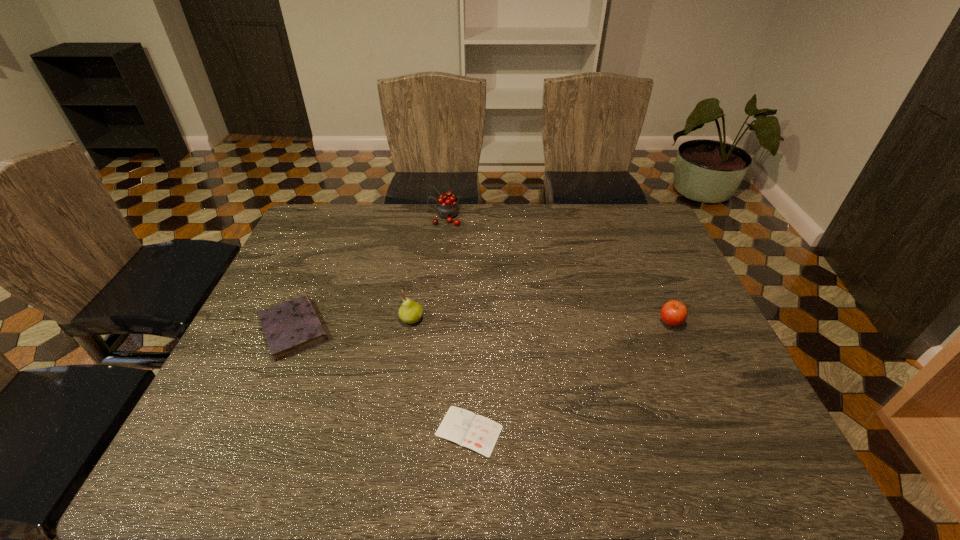
At what (x,y) coordinates should I click in order to perform the action: click on the farthest object. Please return your answer as a coordinate pair (x, y). Looking at the image, I should click on tap(447, 207).

Image resolution: width=960 pixels, height=540 pixels. I want to click on pear, so click(410, 312).

Where is `the rightmost object`? the rightmost object is located at coordinates (674, 313).

Where is `apple`? The height and width of the screenshot is (540, 960). apple is located at coordinates (674, 313).

At what (x,y) coordinates should I click in order to perform the action: click on the left diary. Please return your answer as a coordinate pair (x, y). This screenshot has height=540, width=960. Looking at the image, I should click on (293, 326).

Where is `the farther diary`? The height and width of the screenshot is (540, 960). the farther diary is located at coordinates (293, 326).

The width and height of the screenshot is (960, 540). Identify the location of the nearest object. (478, 433).

This screenshot has height=540, width=960. I want to click on the shortest object, so (x=478, y=433).

Identify the location of vacant space located on the handle side of the cherry. (396, 217).

Locate an element on the screen. free space located 0.370m on the handle side of the cherry is located at coordinates (322, 217).